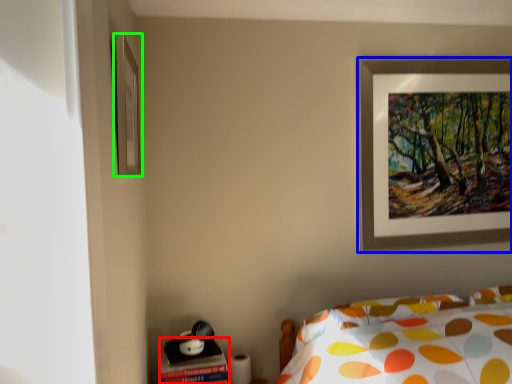
Question: Considering the real-world distances, which object is closest to table (highlighted by a red box)? picture frame (highlighted by a blue box) or picture frame (highlighted by a green box).

Choices:
 (A) picture frame
 (B) picture frame

Answer: (B)